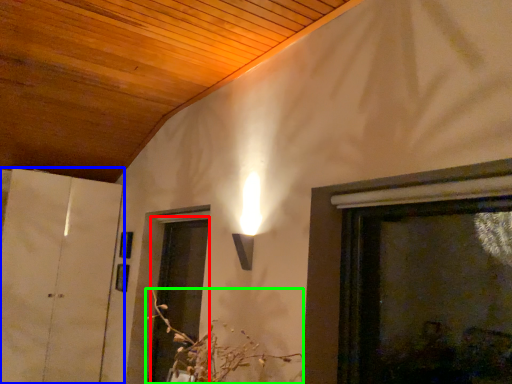
Question: Which object is the farthest from screen door (highlighted by a red box)? Choose among these: door (highlighted by a blue box) or flower (highlighted by a green box).

Choices:
 (A) door
 (B) flower

Answer: (B)